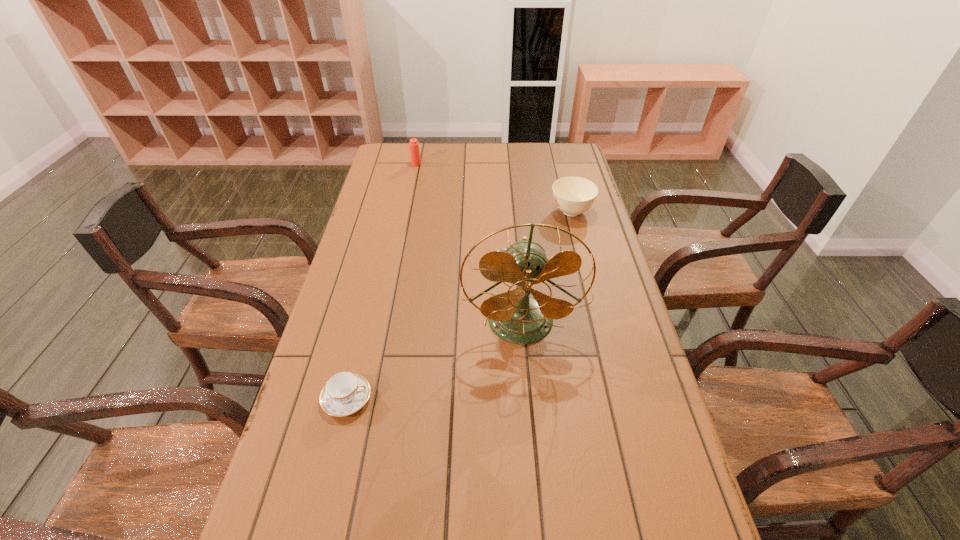
Locate an element on the screen. This screenshot has height=540, width=960. vacant space at the right edge of the desktop is located at coordinates (691, 504).

In order to click on vacant area at the far left corner in this screenshot , I will do `click(378, 167)`.

In the image, there is a desktop. At what (x,y) coordinates should I click in order to perform the action: click on free space at the far right corner. Please return your answer as a coordinate pair (x, y). This screenshot has width=960, height=540. Looking at the image, I should click on (541, 159).

Find the location of `vacant space in between the third farthest object and the farthest object`. vacant space in between the third farthest object and the farthest object is located at coordinates click(x=468, y=243).

This screenshot has height=540, width=960. Find the location of `free space that is in between the Tabasco sauce and the nearest object`. free space that is in between the Tabasco sauce and the nearest object is located at coordinates (381, 281).

Locate an element on the screen. The width and height of the screenshot is (960, 540). empty location between the third tallest object and the second tallest object is located at coordinates (493, 188).

Find the location of `free space between the nearest object and the fan`. free space between the nearest object and the fan is located at coordinates (434, 360).

I want to click on unoccupied position between the Tabasco sauce and the teacup, so click(381, 281).

You are a GUI agent. You are given a task and a screenshot of the screen. Output one action in this format:
    pyautogui.click(x=<x>, y=<y>)
    Task: Click on the vacant area that lies between the nearest object and the Tabasco sauce
    
    Given the screenshot: What is the action you would take?
    pyautogui.click(x=381, y=281)

The image size is (960, 540). In order to click on free spot between the shortest object and the sugar bowl in this screenshot , I will do `click(459, 305)`.